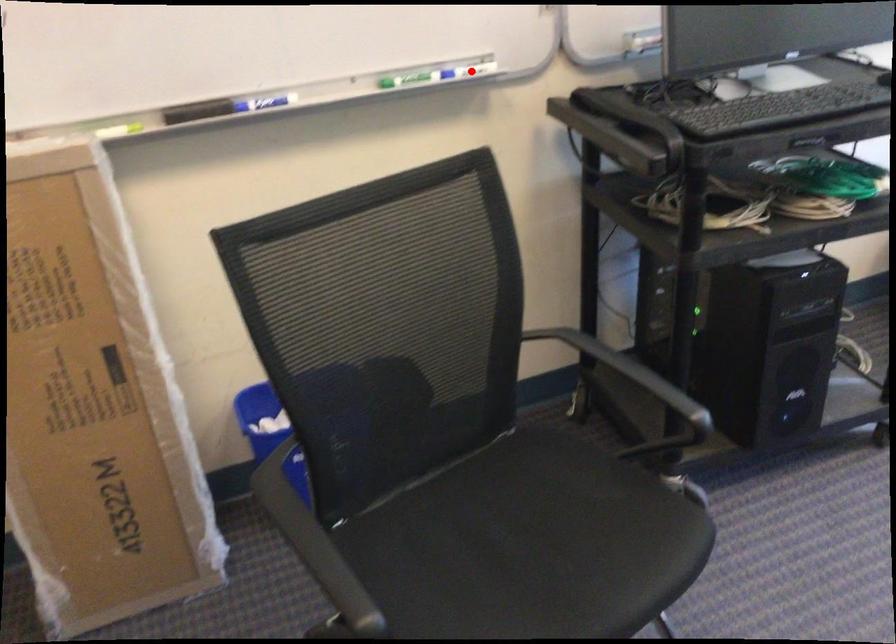
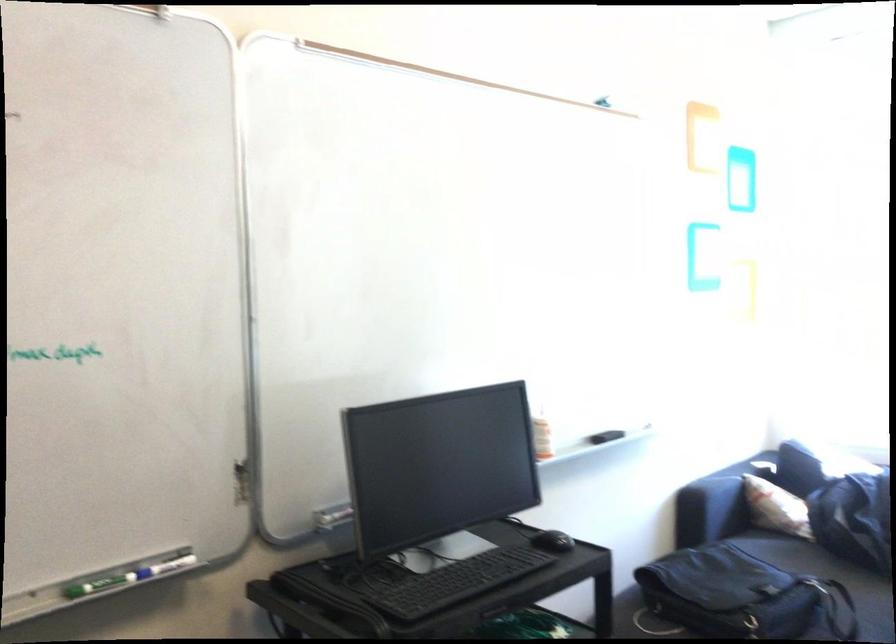
Find the pixel in the second image that matches the highlighted location in the first image.

(165, 567)